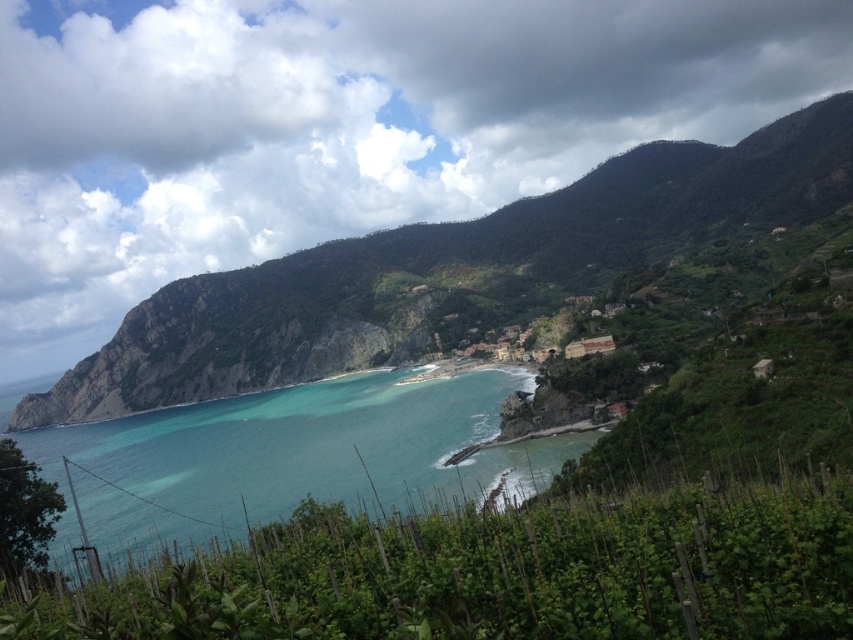
Consider the image. You are a tourist standing at the edge of the vineyard in the coastal landscape. You want to take a photo that includes both the green leafy vines at lower center and the green grassy mountain at center. Which object should you position closer to the bottom of your camera frame?

You should position the green leafy vines at lower center closer to the bottom of your camera frame because it is located below the green grassy mountain at center.

You are standing at the point marked by the coordinates point (500, 572) in the vineyard. Looking towards the village in the middle ground, which direction should you walk to reach the village?

You should walk north towards the village in the middle ground because the point (500, 572) is located at the lower center of the image, which is south of the village.

You are standing at the lower edge of the image and looking towards the vineyard. Where would you see the green leafy vines at lower center?

The green leafy vines at lower center are located at the point with coordinates 0.895 on the x axis and 0.587 on the y axis, so you would see them slightly to the right and above your current position.